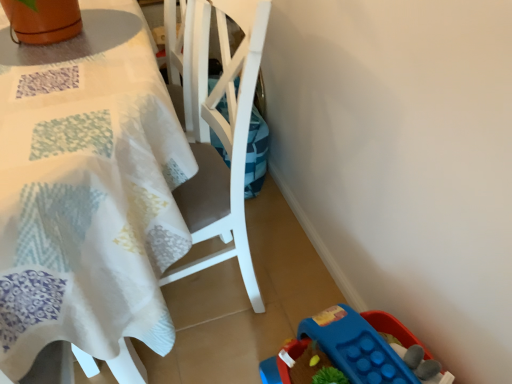
Question: Considering their positions, is blue plastic toy at lower right located in front of or behind white plastic chair at center?

Choices:
 (A) behind
 (B) front

Answer: (A)

Question: Based on their positions, is blue plastic toy at lower right located to the left or right of white plastic chair at center?

Choices:
 (A) right
 (B) left

Answer: (A)

Question: Which object is the farthest from the white fabric table at upper left?

Choices:
 (A) blue plastic toy at lower right
 (B) white plastic chair at center

Answer: (A)

Question: Which object is positioned closest to the white fabric table at upper left?

Choices:
 (A) white plastic chair at center
 (B) blue plastic toy at lower right

Answer: (A)